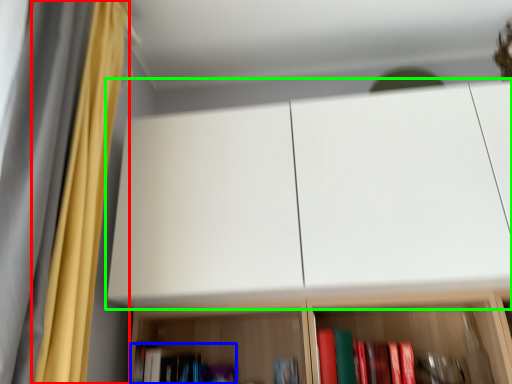
Question: Which object is the farthest from curtain (highlighted by a red box)? Choose among these: book (highlighted by a blue box) or cabinetry (highlighted by a green box).

Choices:
 (A) book
 (B) cabinetry

Answer: (A)